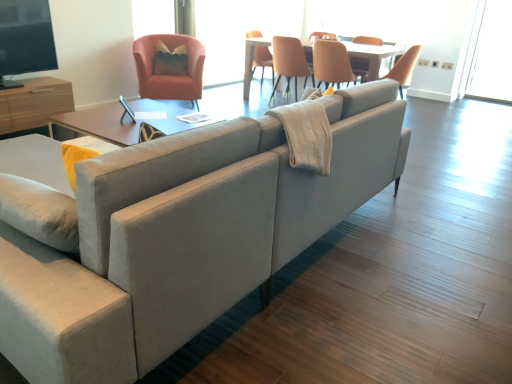
Question: Would you consider transparent glass window screen at upper center, which is the 1th window screen from left to right, to be distant from matte orange chair at upper center, which is the 2th chair from right to left?

Choices:
 (A) no
 (B) yes

Answer: (B)

Question: From a real-world perspective, is transparent glass window screen at upper center, the third window screen in the right-to-left sequence, on matte orange chair at upper center, which is the 2th chair from right to left?

Choices:
 (A) no
 (B) yes

Answer: (B)

Question: Does transparent glass window screen at upper center, which is the 1th window screen from left to right, touch matte orange chair at upper center, which ranks as the second chair in left-to-right order?

Choices:
 (A) no
 (B) yes

Answer: (A)

Question: Is transparent glass window screen at upper center, which is the 1th window screen from left to right, located outside matte orange chair at upper center, which is the 2th chair from right to left?

Choices:
 (A) yes
 (B) no

Answer: (A)

Question: From a real-world perspective, is transparent glass window screen at upper center, the third window screen in the right-to-left sequence, positioned under matte orange chair at upper center, which ranks as the second chair in left-to-right order, based on gravity?

Choices:
 (A) no
 (B) yes

Answer: (A)

Question: Is transparent glass window screen at upper center, the third window screen in the right-to-left sequence, inside the boundaries of leather-like beige chair at center, the 1th chair viewed from the right, or outside?

Choices:
 (A) inside
 (B) outside

Answer: (B)

Question: Based on their positions, is transparent glass window screen at upper center, the third window screen in the right-to-left sequence, located to the left or right of leather-like beige chair at center, marked as the third chair in a left-to-right arrangement?

Choices:
 (A) right
 (B) left

Answer: (B)

Question: Considering the positions of transparent glass window screen at upper center, the third window screen in the right-to-left sequence, and leather-like beige chair at center, the 1th chair viewed from the right, in the image, is transparent glass window screen at upper center, the third window screen in the right-to-left sequence, taller or shorter than leather-like beige chair at center, the 1th chair viewed from the right,?

Choices:
 (A) tall
 (B) short

Answer: (B)

Question: From the image's perspective, is transparent glass window screen at upper center, the third window screen in the right-to-left sequence, located above or below leather-like beige chair at center, marked as the third chair in a left-to-right arrangement?

Choices:
 (A) above
 (B) below

Answer: (A)

Question: Is point (274, 39) positioned closer to the camera than point (482, 97)?

Choices:
 (A) farther
 (B) closer

Answer: (B)

Question: Relative to transparent glass window at upper right, the first window screen positioned from the right, is matte orange chair at upper center, which ranks as the second chair in left-to-right order, in front or behind?

Choices:
 (A) front
 (B) behind

Answer: (A)

Question: Is matte orange chair at upper center, which ranks as the second chair in left-to-right order, bigger or smaller than transparent glass window at upper right, the first window screen positioned from the right?

Choices:
 (A) small
 (B) big

Answer: (B)

Question: From a real-world perspective, is matte orange chair at upper center, which is the 2th chair from right to left, above or below transparent glass window at upper right, which is counted as the 3th window screen, starting from the left?

Choices:
 (A) below
 (B) above

Answer: (A)

Question: In terms of height, does wooden entertainment center at left, marked as the 1th entertainment center in a bottom-to-top arrangement, look taller or shorter compared to matte black tv at upper left, which ranks as the 1th entertainment center in top-to-bottom order?

Choices:
 (A) tall
 (B) short

Answer: (B)

Question: Does point (40, 99) appear closer or farther from the camera than point (36, 122)?

Choices:
 (A) closer
 (B) farther

Answer: (B)